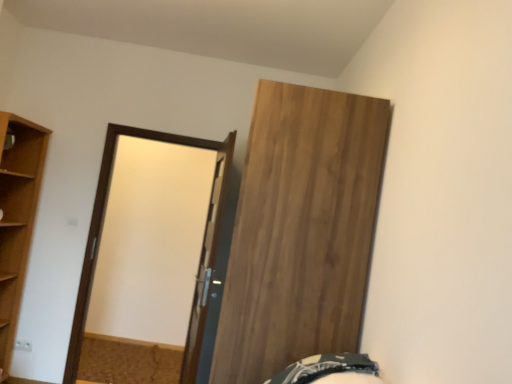
Question: Is light brown wood at left inside dark green fabric bed at lower right?

Choices:
 (A) no
 (B) yes

Answer: (A)

Question: Does dark green fabric bed at lower right have a greater width compared to light brown wood at left?

Choices:
 (A) yes
 (B) no

Answer: (B)

Question: From the image's perspective, is dark green fabric bed at lower right above light brown wood at left?

Choices:
 (A) no
 (B) yes

Answer: (A)

Question: From a real-world perspective, is dark green fabric bed at lower right on top of light brown wood at left?

Choices:
 (A) yes
 (B) no

Answer: (A)

Question: Could you tell me if dark green fabric bed at lower right is facing light brown wood at left?

Choices:
 (A) yes
 (B) no

Answer: (B)

Question: From the image's perspective, is light brown wood at left positioned above or below matte brown door at center?

Choices:
 (A) below
 (B) above

Answer: (B)

Question: Based on their positions, is light brown wood at left located to the left or right of matte brown door at center?

Choices:
 (A) left
 (B) right

Answer: (A)

Question: Which is correct: light brown wood at left is inside matte brown door at center, or outside of it?

Choices:
 (A) inside
 (B) outside

Answer: (B)

Question: Considering the positions of light brown wood at left and matte brown door at center in the image, is light brown wood at left bigger or smaller than matte brown door at center?

Choices:
 (A) small
 (B) big

Answer: (B)

Question: Does point (256, 291) appear closer or farther from the camera than point (330, 362)?

Choices:
 (A) closer
 (B) farther

Answer: (B)

Question: Visually, is wooden door at upper right, marked as the second door in a left-to-right arrangement, positioned to the left or to the right of dark green fabric bed at lower right?

Choices:
 (A) left
 (B) right

Answer: (A)

Question: Is wooden door at upper right, the 1th door when ordered from right to left, wider or thinner than dark green fabric bed at lower right?

Choices:
 (A) thin
 (B) wide

Answer: (B)

Question: Considering their positions, is wooden door at upper right, marked as the second door in a left-to-right arrangement, located in front of or behind dark green fabric bed at lower right?

Choices:
 (A) front
 (B) behind

Answer: (B)

Question: Does point (310, 364) appear closer or farther from the camera than point (247, 152)?

Choices:
 (A) closer
 (B) farther

Answer: (A)

Question: Is dark green fabric bed at lower right situated inside wooden door at upper right, the 1th door when ordered from right to left, or outside?

Choices:
 (A) inside
 (B) outside

Answer: (B)